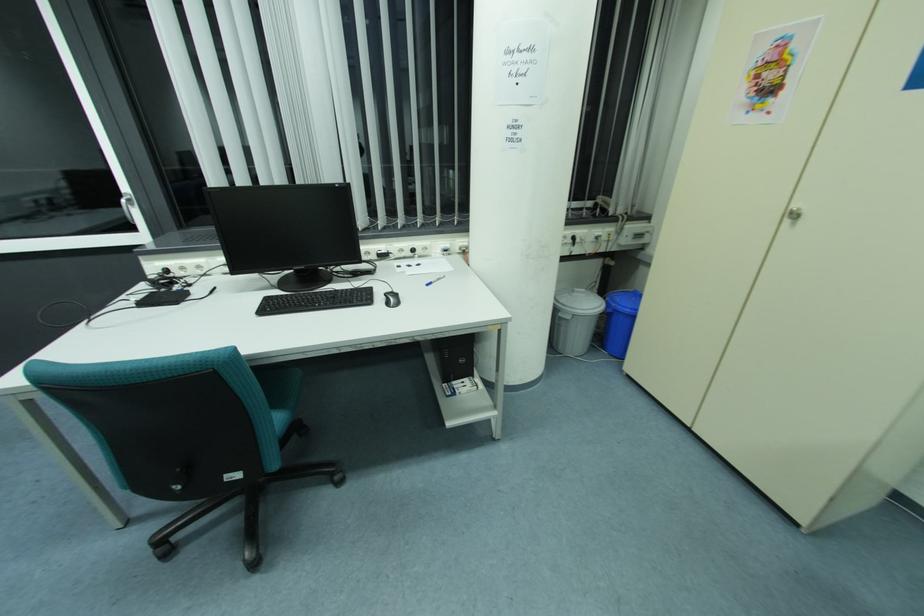
Locate an element on the screen. This screenshot has height=616, width=924. white window handle is located at coordinates (128, 206).